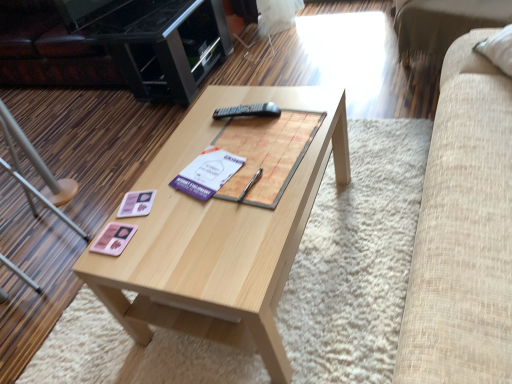
This screenshot has width=512, height=384. What are the coordinates of `vacant space behind white paper at center` in the screenshot? It's located at (204, 146).